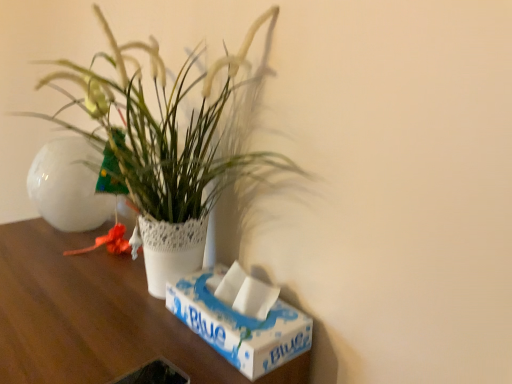
Where is `free point in front of white glossy flowerpot at left`? free point in front of white glossy flowerpot at left is located at coordinates (40, 262).